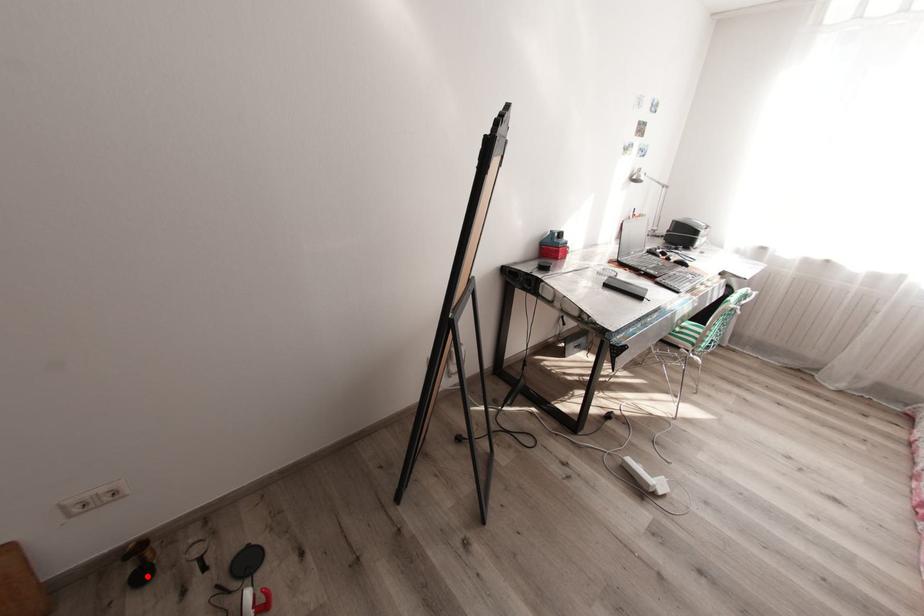
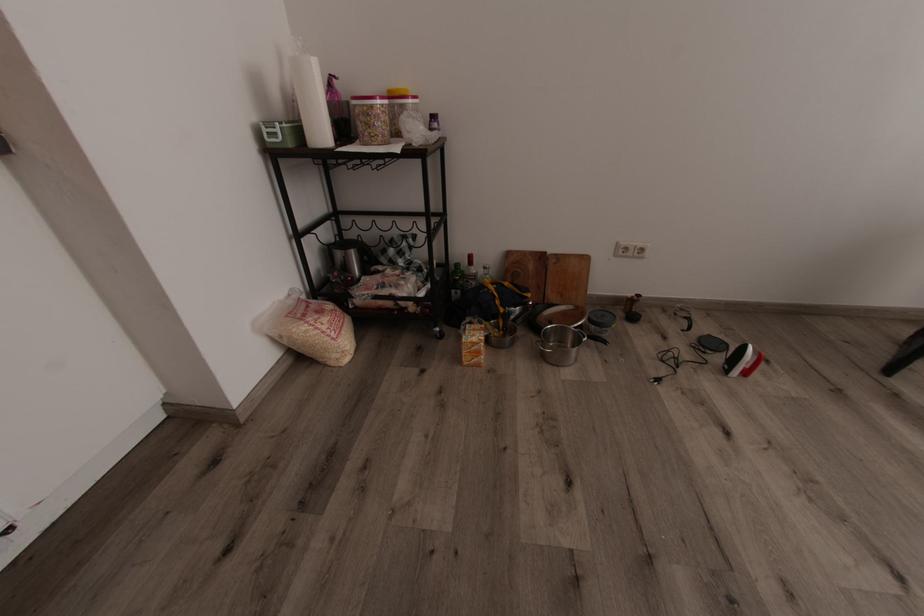
Question: I am providing you with two images of the same scene from different viewpoints. A red point is marked on the first image. At the location where the point appears in image 1, is it still visible in image 2?

Choices:
 (A) Yes
 (B) No

Answer: (A)